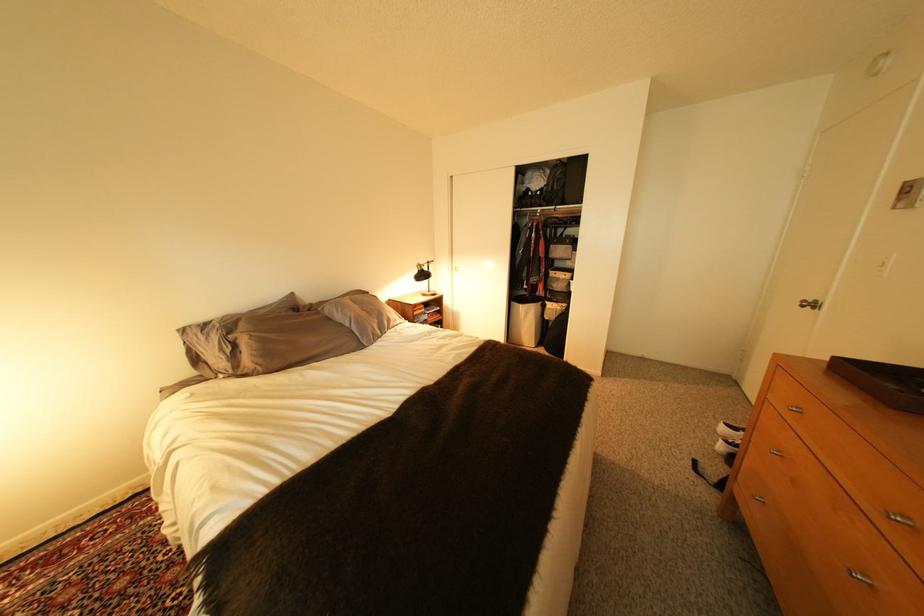
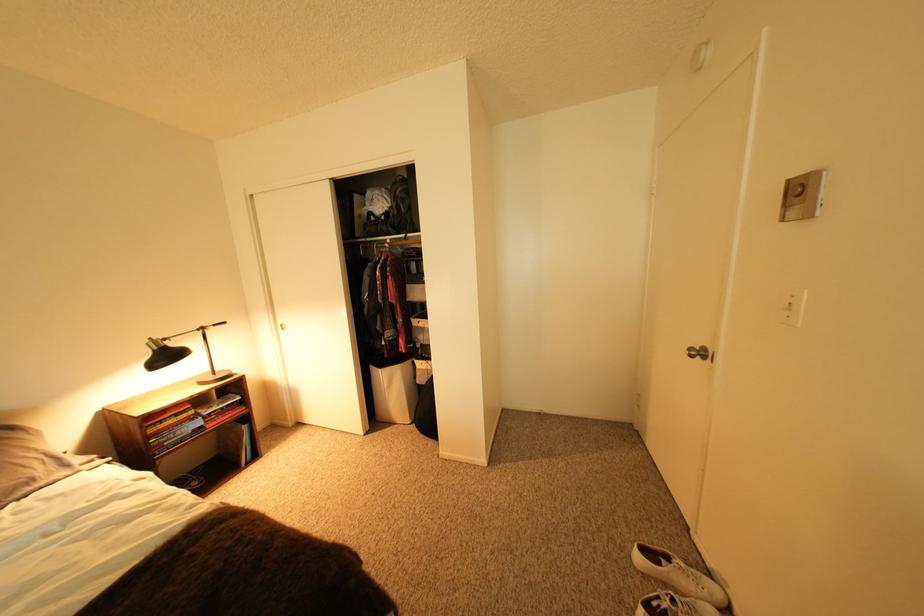
Find the pixel in the second image that matches (533,307) in the first image.

(393, 371)